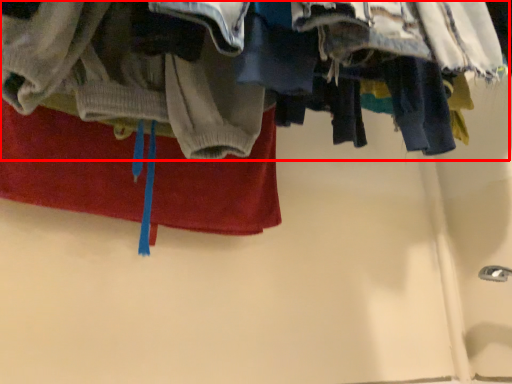
Question: From the image, what is the correct spatial relationship of closet (annotated by the red box) in relation to towel?

Choices:
 (A) left
 (B) right

Answer: (B)